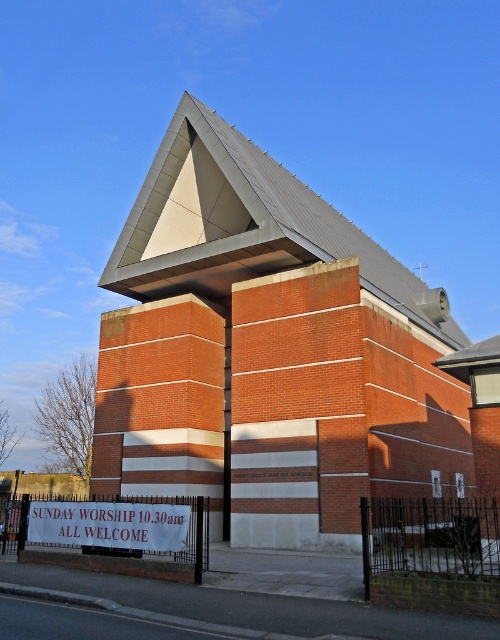
Question: Is brick chapel at center positioned behind white fabric sign at lower center?

Choices:
 (A) no
 (B) yes

Answer: (B)

Question: Is brick chapel at center closer to camera compared to white fabric sign at lower center?

Choices:
 (A) yes
 (B) no

Answer: (B)

Question: Is the position of brick chapel at center less distant than that of white fabric sign at lower center?

Choices:
 (A) no
 (B) yes

Answer: (A)

Question: Among these points, which one is farthest from the camera?

Choices:
 (A) (426, 436)
 (B) (36, 524)

Answer: (A)